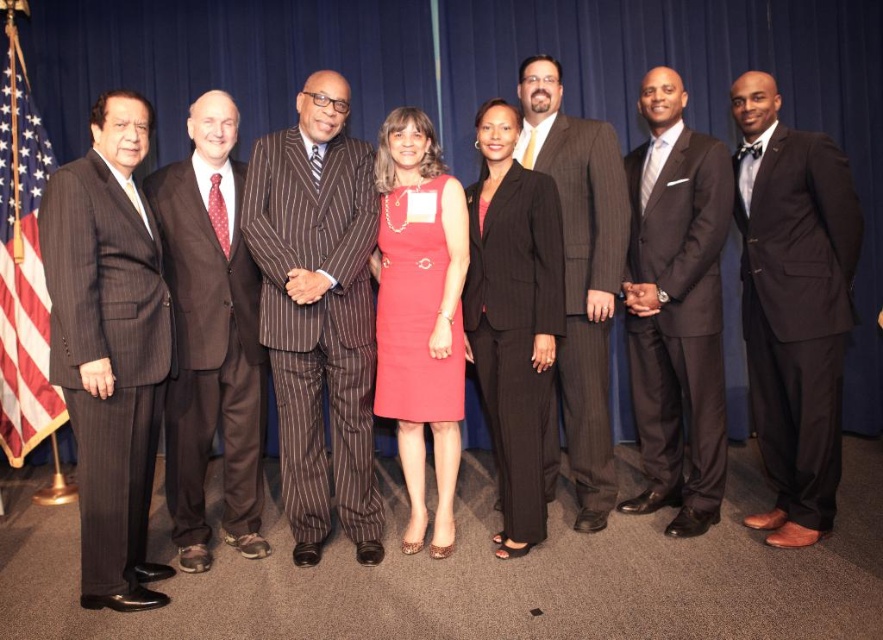
Question: Which object is the closest to the american flag at left?

Choices:
 (A) matte black suit at center
 (B) brown pinstripe suit at left
 (C) matte pinstripe suit at center
 (D) dark gray pinstripe suit at left

Answer: (B)

Question: Considering the real-world distances, which object is farthest from the brown pinstripe suit at center?

Choices:
 (A) matte pinstripe suit at center
 (B) dark gray pinstripe suit at left

Answer: (A)

Question: Does shiny black suit at right have a smaller size compared to american flag at left?

Choices:
 (A) no
 (B) yes

Answer: (A)

Question: Does brown pinstripe suit at center have a lesser width compared to matte pinstripe suit at center?

Choices:
 (A) yes
 (B) no

Answer: (B)

Question: Which of the following is the closest to the observer?

Choices:
 (A) dark gray pinstripe suit at left
 (B) brown pinstripe suit at center
 (C) american flag at left

Answer: (A)

Question: Can you confirm if matte pinstripe suit at center is smaller than american flag at left?

Choices:
 (A) yes
 (B) no

Answer: (B)